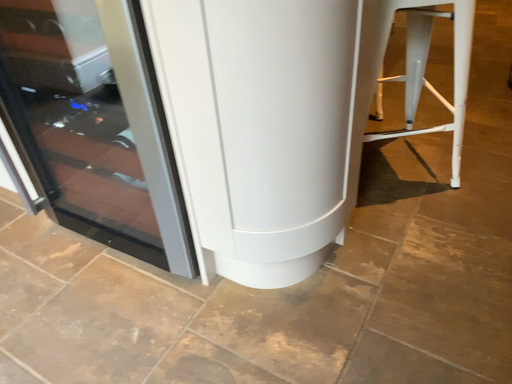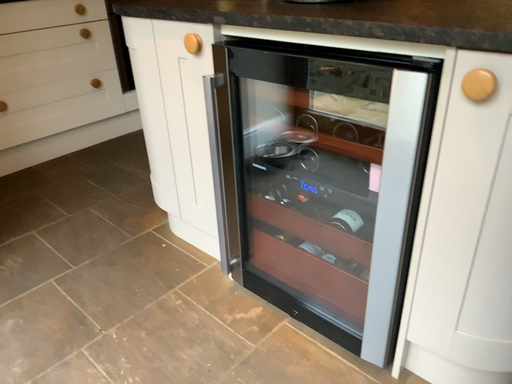
Question: How did the camera likely rotate when shooting the video?

Choices:
 (A) rotated upward
 (B) rotated downward

Answer: (A)